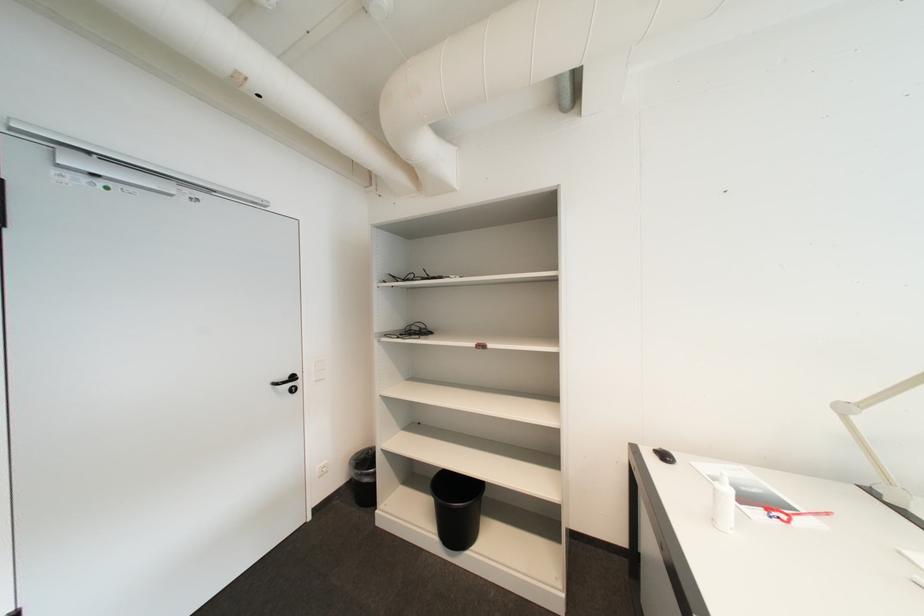
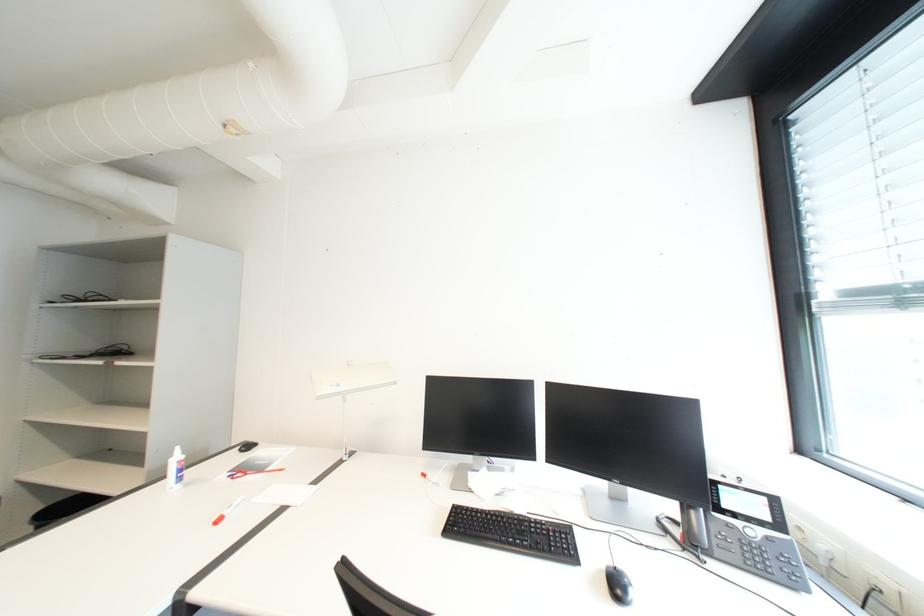
In a continuous first-person perspective shot, in which direction is the camera moving?

The movement direction of the cameraman is right, backward.